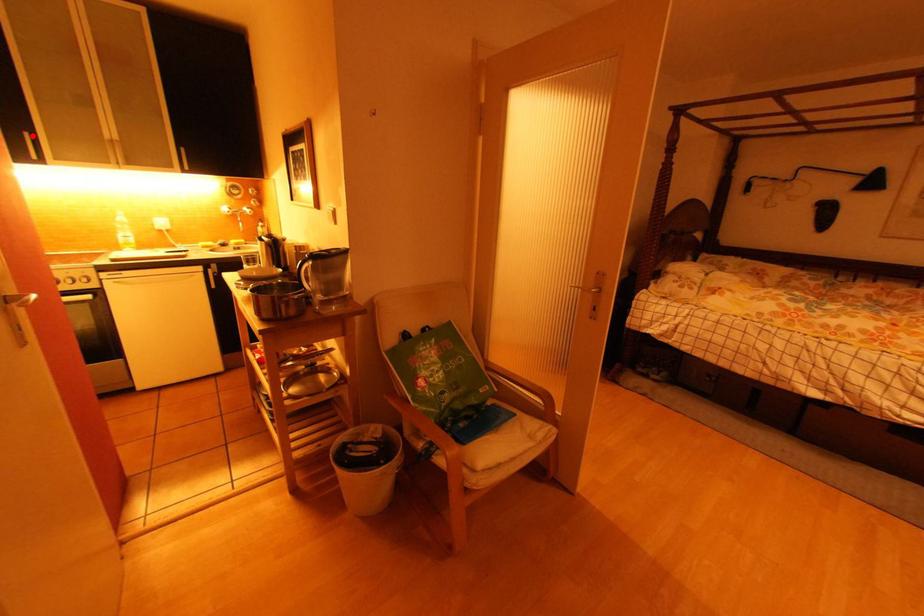
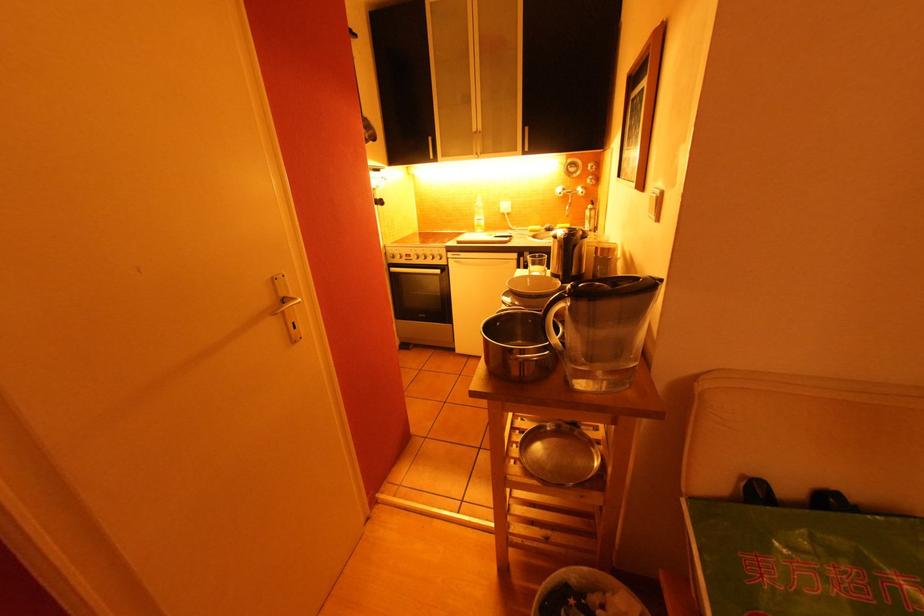
Locate, in the second image, the point that corresponds to the highlighted location in the first image.

(434, 140)